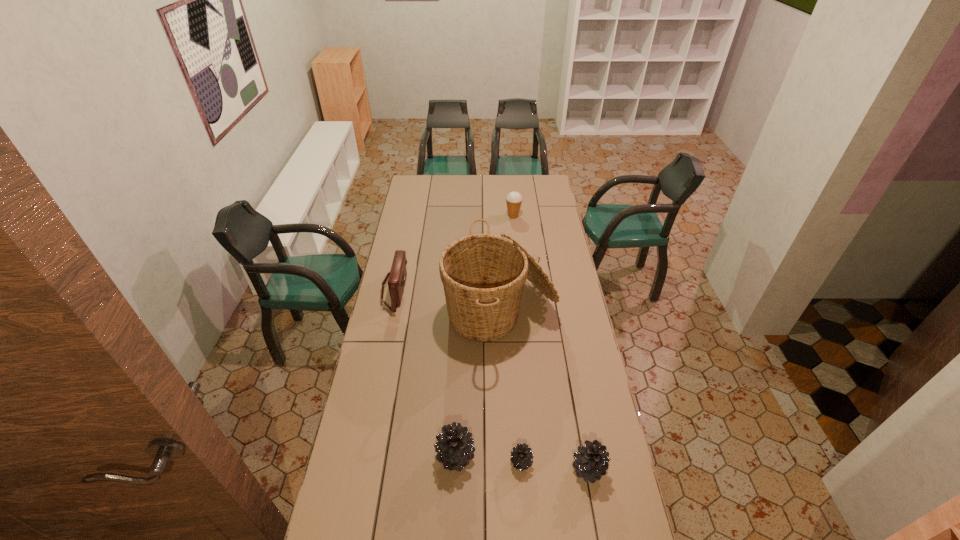
Identify the location of vacant area that lies between the shoulder bag and the shortest object. The image size is (960, 540). (458, 376).

In order to click on unoccupied area between the rightmost pinecone and the leftmost object in this screenshot , I will do `click(492, 380)`.

This screenshot has width=960, height=540. I want to click on free space between the farthest object and the rightmost pinecone, so click(x=551, y=342).

This screenshot has width=960, height=540. I want to click on vacant space in between the second shortest pinecone and the shortest object, so click(555, 465).

Locate an element on the screen. The height and width of the screenshot is (540, 960). vacant area that lies between the leftmost pinecone and the leftmost object is located at coordinates (425, 373).

Locate an element on the screen. vacant space that's between the tallest object and the leftmost pinecone is located at coordinates (478, 386).

In order to click on free space between the icecream and the second shortest pinecone in this screenshot , I will do `click(551, 342)`.

The image size is (960, 540). In order to click on the second closest object to the leftmost pinecone in this screenshot , I will do `click(483, 275)`.

Locate which object ranks fifth in proximity to the tallest object. Please provide its 2D coordinates. Your answer should be formatted as a tuple, i.e. [(x, y)], where the tuple contains the x and y coordinates of a point satisfying the conditions above.

[(514, 199)]

Locate which pinecone ranks second in proximity to the shortest pinecone. Please provide its 2D coordinates. Your answer should be formatted as a tuple, i.e. [(x, y)], where the tuple contains the x and y coordinates of a point satisfying the conditions above.

[(591, 463)]